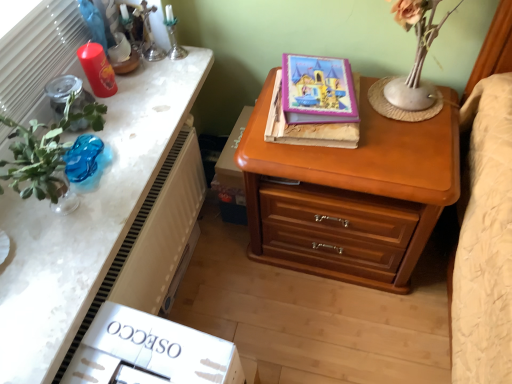
Question: Is the depth of wooden chest of drawers at right greater than that of white textured radiator at left?

Choices:
 (A) no
 (B) yes

Answer: (B)

Question: Can you confirm if wooden chest of drawers at right is shorter than white textured radiator at left?

Choices:
 (A) yes
 (B) no

Answer: (B)

Question: Considering the relative positions of wooden chest of drawers at right and white textured radiator at left in the image provided, is wooden chest of drawers at right to the left of white textured radiator at left from the viewer's perspective?

Choices:
 (A) no
 (B) yes

Answer: (A)

Question: Could you tell me if wooden chest of drawers at right is facing white textured radiator at left?

Choices:
 (A) no
 (B) yes

Answer: (A)

Question: Is wooden chest of drawers at right looking in the opposite direction of white textured radiator at left?

Choices:
 (A) no
 (B) yes

Answer: (A)

Question: Do you think translucent blue glass vase at left is within white textured radiator at left, or outside of it?

Choices:
 (A) inside
 (B) outside

Answer: (B)

Question: From their relative heights in the image, would you say translucent blue glass vase at left is taller or shorter than white textured radiator at left?

Choices:
 (A) short
 (B) tall

Answer: (A)

Question: Is translucent blue glass vase at left to the left or to the right of white textured radiator at left in the image?

Choices:
 (A) left
 (B) right

Answer: (A)

Question: Relative to white textured radiator at left, is translucent blue glass vase at left in front or behind?

Choices:
 (A) front
 (B) behind

Answer: (B)

Question: Is wooden nightstand at upper center spatially inside white textured radiator at left, or outside of it?

Choices:
 (A) inside
 (B) outside

Answer: (B)

Question: Considering the positions of wooden nightstand at upper center and white textured radiator at left in the image, is wooden nightstand at upper center wider or thinner than white textured radiator at left?

Choices:
 (A) thin
 (B) wide

Answer: (B)

Question: In the image, is wooden nightstand at upper center positioned in front of or behind white textured radiator at left?

Choices:
 (A) behind
 (B) front

Answer: (B)

Question: Considering the positions of wooden nightstand at upper center and white textured radiator at left in the image, is wooden nightstand at upper center taller or shorter than white textured radiator at left?

Choices:
 (A) short
 (B) tall

Answer: (A)

Question: Is purple glossy book at upper center, which ranks as the second book in bottom-to-top order, inside or outside of wooden chest of drawers at right?

Choices:
 (A) inside
 (B) outside

Answer: (B)

Question: Is point (347, 107) positioned closer to the camera than point (412, 178)?

Choices:
 (A) farther
 (B) closer

Answer: (A)